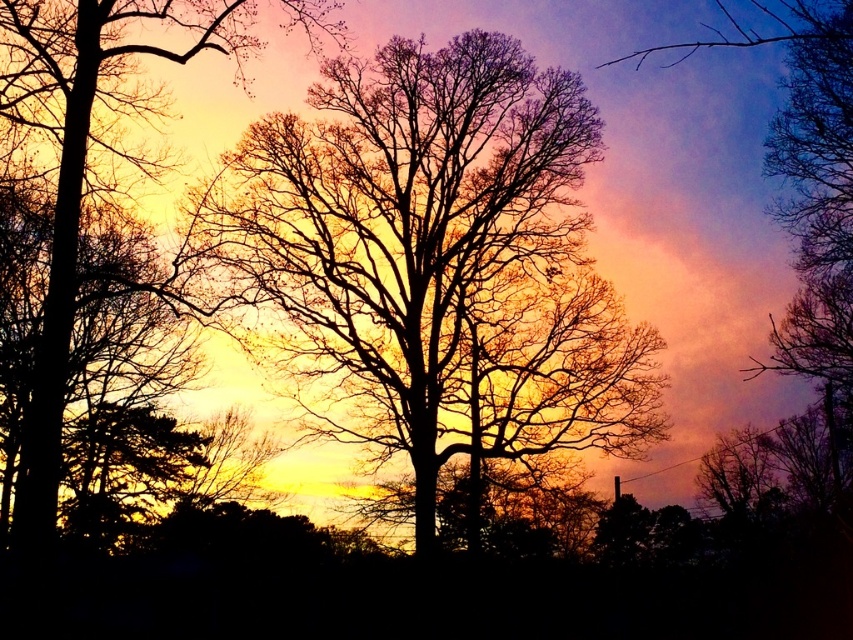
Question: Among these objects, which one is nearest to the camera?

Choices:
 (A) silhouette tree at left
 (B) silhouette tree at center

Answer: (A)

Question: Does silhouette tree at center lie in front of silhouette tree at left?

Choices:
 (A) no
 (B) yes

Answer: (A)

Question: Can you confirm if silhouette tree at center is positioned to the right of silhouette tree at left?

Choices:
 (A) no
 (B) yes

Answer: (B)

Question: Which object is closer to the camera taking this photo?

Choices:
 (A) silhouette tree at left
 (B) silhouette tree at center

Answer: (A)

Question: Does silhouette tree at center appear on the left side of silhouette tree at left?

Choices:
 (A) no
 (B) yes

Answer: (A)